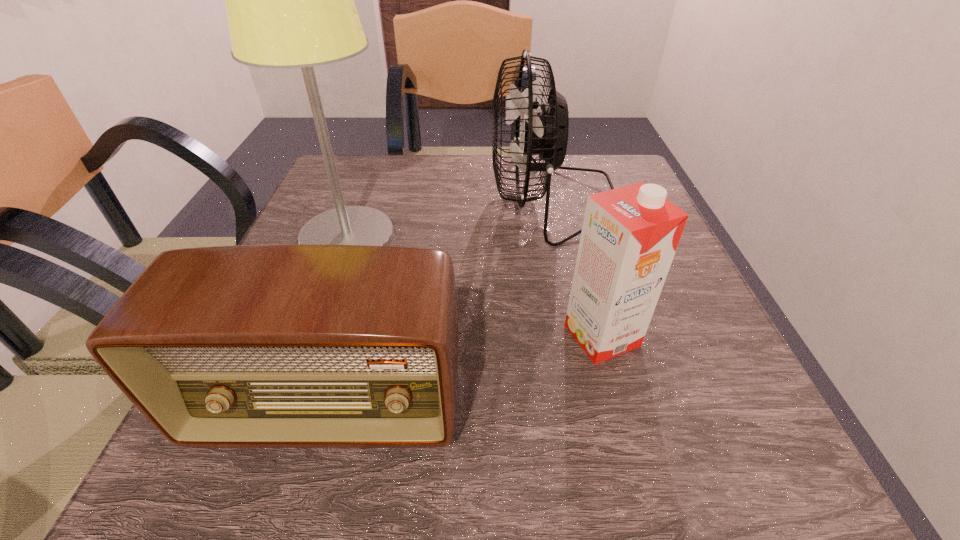
Locate an element on the screen. The image size is (960, 540). object located at the near edge is located at coordinates (291, 345).

Identify the location of table lamp located in the left edge section of the desktop. The image size is (960, 540). (289, 0).

The width and height of the screenshot is (960, 540). In order to click on radio receiver that is at the left edge in this screenshot , I will do `click(291, 345)`.

The height and width of the screenshot is (540, 960). Identify the location of fan present at the right edge. (544, 131).

Find the location of `carton that is positioned at the right edge`. carton that is positioned at the right edge is located at coordinates (630, 234).

You are a GUI agent. You are given a task and a screenshot of the screen. Output one action in this format:
    pyautogui.click(x=<x>, y=<y>)
    Task: Click on the object at the near left corner
    The width and height of the screenshot is (960, 540).
    Given the screenshot: What is the action you would take?
    pyautogui.click(x=291, y=345)

At what (x,y) coordinates should I click in order to perform the action: click on object located in the far right corner section of the desktop. Please return your answer as a coordinate pair (x, y). The height and width of the screenshot is (540, 960). Looking at the image, I should click on (544, 131).

Locate an element on the screen. blank space at the far edge is located at coordinates (484, 192).

Where is `free region at the near edge of the desktop`? free region at the near edge of the desktop is located at coordinates (520, 442).

In the image, there is a desktop. At what (x,y) coordinates should I click in order to perform the action: click on vacant space at the right edge. Please return your answer as a coordinate pair (x, y). The image size is (960, 540). Looking at the image, I should click on (736, 421).